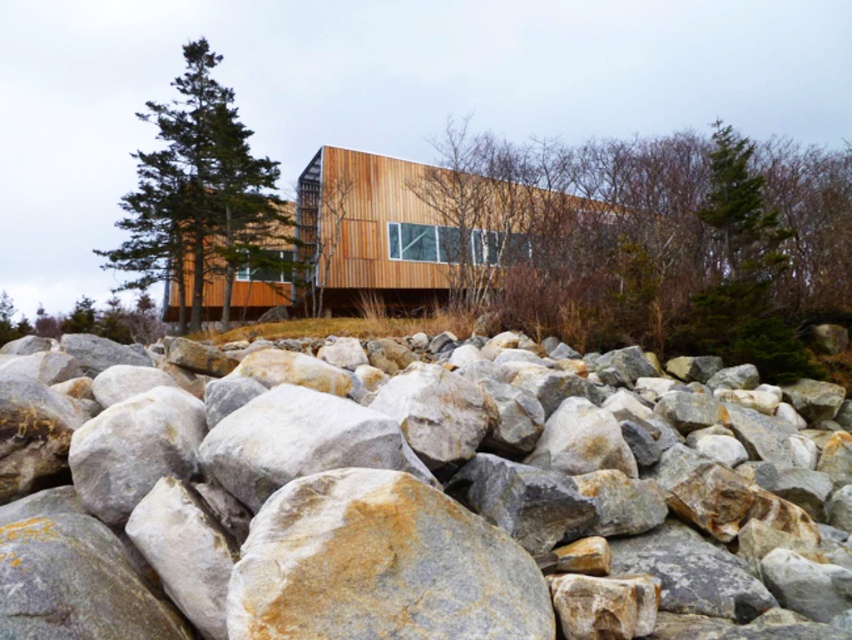
Question: Which point is farther from the camera taking this photo?

Choices:
 (A) (594, 314)
 (B) (171, 278)
 (C) (786, 522)
 (D) (373, 515)

Answer: (B)

Question: Which point is closer to the camera?

Choices:
 (A) green leafy tree at center
 (B) green matte tree at upper left
 (C) gray/textured rock at center

Answer: (C)

Question: Which point is closer to the camera?

Choices:
 (A) (343, 492)
 (B) (825, 250)

Answer: (A)

Question: In this image, where is green leafy tree at center located relative to green matte tree at upper left?

Choices:
 (A) right
 (B) left

Answer: (A)

Question: Is gray/granite rocks at center to the left of green matte tree at upper left from the viewer's perspective?

Choices:
 (A) yes
 (B) no

Answer: (B)

Question: In this image, where is green leafy tree at center located relative to green matte tree at upper left?

Choices:
 (A) left
 (B) right

Answer: (B)